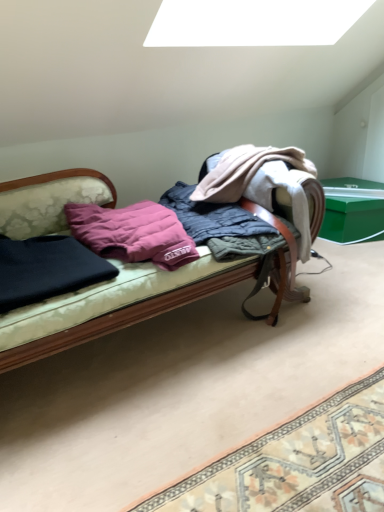
Question: In terms of height, does dark blue fabric at left, positioned as the second clothing in right-to-left order, look taller or shorter compared to green plastic box at right?

Choices:
 (A) short
 (B) tall

Answer: (A)

Question: Considering the positions of dark blue fabric at left, positioned as the second clothing in right-to-left order, and green plastic box at right in the image, is dark blue fabric at left, positioned as the second clothing in right-to-left order, wider or thinner than green plastic box at right?

Choices:
 (A) wide
 (B) thin

Answer: (B)

Question: Which object is positioned farthest from the green plastic box at right?

Choices:
 (A) quilted fabric blanket at center, the second clothing positioned from the left
 (B) dark blue fabric at left, arranged as the 1th clothing when viewed from the left
 (C) purple down pillow at center
 (D) velvet-like fabric couch at center
 (E) patterned fabric mat at lower right

Answer: (B)

Question: Estimate the real-world distances between objects in this image. Which object is closer to the green plastic box at right?

Choices:
 (A) patterned fabric mat at lower right
 (B) quilted fabric blanket at center, the second clothing positioned from the left
 (C) dark blue fabric at left, arranged as the 1th clothing when viewed from the left
 (D) purple down pillow at center
 (E) velvet-like fabric couch at center

Answer: (B)